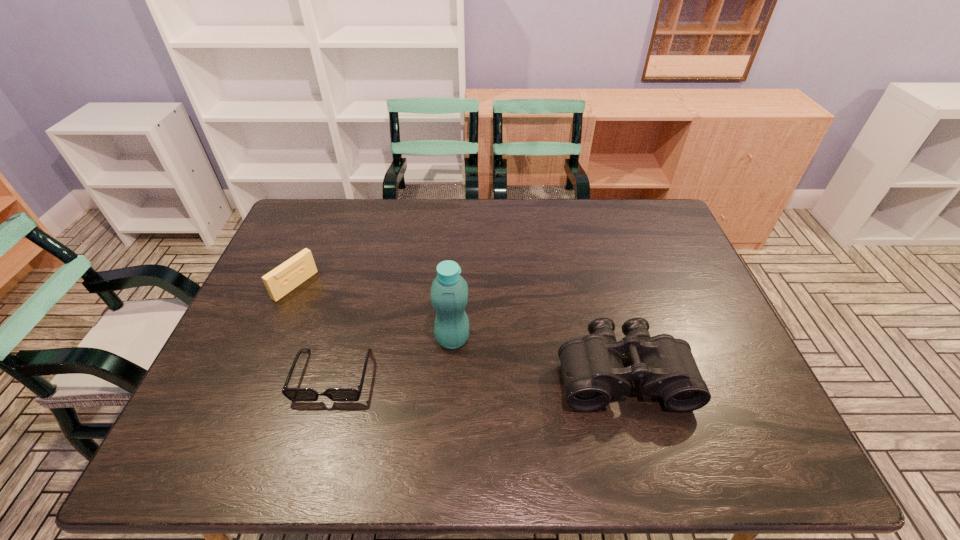
Find the location of a particular element. This screenshot has height=540, width=960. the shortest object is located at coordinates (293, 394).

Image resolution: width=960 pixels, height=540 pixels. Identify the location of the third object from right to left. (293, 394).

This screenshot has height=540, width=960. Find the location of `the rightmost object`. the rightmost object is located at coordinates (593, 372).

This screenshot has height=540, width=960. I want to click on binoculars, so click(x=593, y=372).

Find the location of a particular element. The height and width of the screenshot is (540, 960). videotape is located at coordinates (280, 281).

Identify the location of the second shortest object. The image size is (960, 540). (280, 281).

At what (x,y) coordinates should I click in order to perform the action: click on water bottle. Please return your answer as a coordinate pair (x, y). Looking at the image, I should click on (449, 293).

The height and width of the screenshot is (540, 960). Find the location of `the tallest object`. the tallest object is located at coordinates (449, 293).

At what (x,y) coordinates should I click in order to perform the action: click on vacant space located 0.340m at the front of the videotape with spools. Please return your answer as a coordinate pair (x, y). Looking at the image, I should click on (394, 349).

Locate an element on the screen. free spot located 0.190m at the front of the videotape with spools is located at coordinates (352, 323).